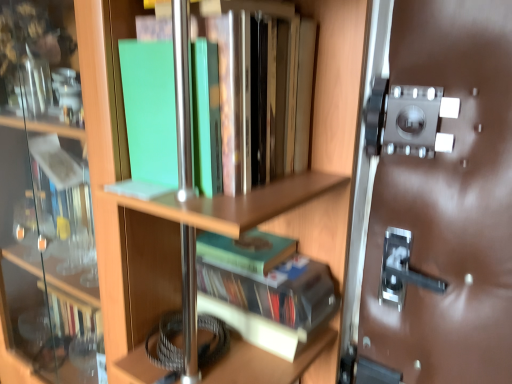
Where is `green matte book at upper left, which appears as the 1th book when viewed from the top`? green matte book at upper left, which appears as the 1th book when viewed from the top is located at coordinates (254, 95).

Which of these two, green matte book at upper left, the 3th book positioned from the bottom, or green matte book at center, which is the 1th book from bottom to top, is smaller?

With smaller size is green matte book at center, which is the 1th book from bottom to top.

Is point (143, 60) in front of point (293, 269)?

Yes.

From a real-world perspective, is green matte book at upper left, which appears as the 1th book when viewed from the top, positioned above or below green matte book at center, which is the 1th book from bottom to top?

green matte book at upper left, which appears as the 1th book when viewed from the top, is situated higher than green matte book at center, which is the 1th book from bottom to top, in the real world.

Is green matte book at upper left, the 3th book positioned from the bottom, turned away from green matte book at center, which is the 1th book from bottom to top?

green matte book at upper left, the 3th book positioned from the bottom, does not have its back to green matte book at center, which is the 1th book from bottom to top.

Can you confirm if green matte book at center, the second book positioned from the bottom, is smaller than green matte book at upper left, the 3th book positioned from the bottom?

Indeed, green matte book at center, the second book positioned from the bottom, has a smaller size compared to green matte book at upper left, the 3th book positioned from the bottom.

From the image's perspective, would you say green matte book at center, the second book positioned from the bottom, is positioned over green matte book at upper left, the 3th book positioned from the bottom?

No, from the image's perspective, green matte book at center, the second book positioned from the bottom, is not above green matte book at upper left, the 3th book positioned from the bottom.

Is green matte book at center, the second book positioned from the bottom, facing towards green matte book at upper left, which appears as the 1th book when viewed from the top?

No, green matte book at center, the second book positioned from the bottom, does not turn towards green matte book at upper left, which appears as the 1th book when viewed from the top.

How much distance is there between green matte book at center, acting as the 2th book starting from the top, and green matte book at upper left, which appears as the 1th book when viewed from the top?

green matte book at center, acting as the 2th book starting from the top, is 32.05 centimeters from green matte book at upper left, which appears as the 1th book when viewed from the top.

From a real-world perspective, which object stands above the other?

green matte book at center, the second book positioned from the bottom, from a real-world perspective.

From the image's perspective, which object appears higher, green matte book at center, which is the 1th book from bottom to top, or green matte book at center, the second book positioned from the bottom?

green matte book at center, the second book positioned from the bottom, is shown above in the image.

Is green matte book at center, which is the 1th book from bottom to top, turned away from green matte book at center, acting as the 2th book starting from the top?

No, green matte book at center, which is the 1th book from bottom to top,'s orientation is not away from green matte book at center, acting as the 2th book starting from the top.

Is green matte book at center, which is the 1th book from bottom to top, far away from green matte book at center, the second book positioned from the bottom?

That's not correct — green matte book at center, which is the 1th book from bottom to top, is a little close to green matte book at center, the second book positioned from the bottom.

Does green matte book at center, which is the third book in top-to-bottom order, have a larger size compared to green matte book at upper left, which appears as the 1th book when viewed from the top?

Actually, green matte book at center, which is the third book in top-to-bottom order, might be smaller than green matte book at upper left, which appears as the 1th book when viewed from the top.

From a real-world perspective, is green matte book at center, which is the third book in top-to-bottom order, positioned above or below green matte book at upper left, which appears as the 1th book when viewed from the top?

Clearly, from a real-world perspective, green matte book at center, which is the third book in top-to-bottom order, is below green matte book at upper left, which appears as the 1th book when viewed from the top.

In the image, is green matte book at center, which is the 1th book from bottom to top, positioned in front of or behind green matte book at upper left, the 3th book positioned from the bottom?

Clearly, green matte book at center, which is the 1th book from bottom to top, is behind green matte book at upper left, the 3th book positioned from the bottom.

Is green matte book at upper left, which appears as the 1th book when viewed from the top, located within green matte book at center, which is the third book in top-to-bottom order?

No, green matte book at upper left, which appears as the 1th book when viewed from the top, is not inside green matte book at center, which is the third book in top-to-bottom order.

Is point (151, 52) closer to viewer compared to point (206, 254)?

Yes, point (151, 52) is closer to viewer.

Looking at the image, does green matte book at upper left, which appears as the 1th book when viewed from the top, seem bigger or smaller compared to green matte book at center, acting as the 2th book starting from the top?

Considering their sizes, green matte book at upper left, which appears as the 1th book when viewed from the top, takes up more space than green matte book at center, acting as the 2th book starting from the top.

Is green matte book at upper left, which appears as the 1th book when viewed from the top, spatially inside green matte book at center, the second book positioned from the bottom, or outside of it?

green matte book at upper left, which appears as the 1th book when viewed from the top, is located beyond the bounds of green matte book at center, the second book positioned from the bottom.

Considering the sizes of objects green matte book at center, acting as the 2th book starting from the top, and green matte book at center, which is the 1th book from bottom to top, in the image provided, who is bigger, green matte book at center, acting as the 2th book starting from the top, or green matte book at center, which is the 1th book from bottom to top,?

green matte book at center, which is the 1th book from bottom to top.

Identify the location of book that is the 1st one when counting leftward from the green matte book at center, which is the third book in top-to-bottom order. This screenshot has width=512, height=384. (246, 251).

Looking at this image, from the image's perspective, is green matte book at center, acting as the 2th book starting from the top, beneath green matte book at center, which is the 1th book from bottom to top?

No, from the image's perspective, green matte book at center, acting as the 2th book starting from the top, is not beneath green matte book at center, which is the 1th book from bottom to top.

From the green matte book at center, which is the 1th book from bottom to top, count the 2nd book to the left and point to it. Please provide its 2D coordinates.

[(254, 95)]

This screenshot has width=512, height=384. Find the location of `book above the green matte book at center, the second book positioned from the bottom (from a real-world perspective)`. book above the green matte book at center, the second book positioned from the bottom (from a real-world perspective) is located at coordinates (254, 95).

Considering their positions, is green matte book at center, which is the third book in top-to-bottom order, positioned closer to green matte book at upper left, which appears as the 1th book when viewed from the top, than green matte book at center, acting as the 2th book starting from the top?

green matte book at center, which is the third book in top-to-bottom order, is closer to green matte book at upper left, which appears as the 1th book when viewed from the top.

When comparing their distances from green matte book at center, which is the 1th book from bottom to top, does green matte book at center, the second book positioned from the bottom, or green matte book at upper left, which appears as the 1th book when viewed from the top, seem further?

Among the two, green matte book at upper left, which appears as the 1th book when viewed from the top, is located further to green matte book at center, which is the 1th book from bottom to top.

Which object lies nearer to the anchor point green matte book at center, acting as the 2th book starting from the top, green matte book at center, which is the 1th book from bottom to top, or green matte book at upper left, which appears as the 1th book when viewed from the top?

green matte book at center, which is the 1th book from bottom to top, lies closer to green matte book at center, acting as the 2th book starting from the top, than the other object.

Which object lies nearer to the anchor point green matte book at center, which is the third book in top-to-bottom order, green matte book at upper left, which appears as the 1th book when viewed from the top, or green matte book at center, acting as the 2th book starting from the top?

The object closer to green matte book at center, which is the third book in top-to-bottom order, is green matte book at center, acting as the 2th book starting from the top.

Which object lies nearer to the anchor point green matte book at upper left, the 3th book positioned from the bottom, green matte book at center, the second book positioned from the bottom, or green matte book at center, which is the third book in top-to-bottom order?

green matte book at center, which is the third book in top-to-bottom order, lies closer to green matte book at upper left, the 3th book positioned from the bottom, than the other object.

In the scene shown: Which object lies nearer to the anchor point green matte book at center, acting as the 2th book starting from the top, green matte book at upper left, which appears as the 1th book when viewed from the top, or green matte book at center, which is the 1th book from bottom to top?

The object closer to green matte book at center, acting as the 2th book starting from the top, is green matte book at center, which is the 1th book from bottom to top.

Locate an element on the screen. The width and height of the screenshot is (512, 384). book between green matte book at upper left, the 3th book positioned from the bottom, and green matte book at center, which is the third book in top-to-bottom order, from top to bottom is located at coordinates (246, 251).